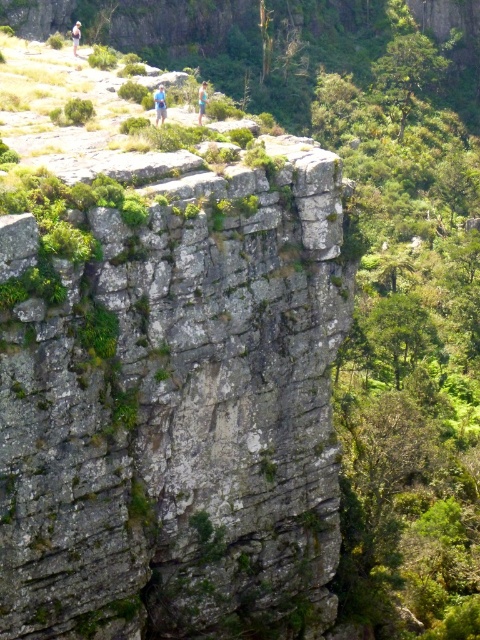
Which is behind, point (157, 97) or point (72, 32)?

The point (72, 32) is behind.

Who is positioned more to the left, blue fabric person at upper center or blue denim shorts at upper left?

Positioned to the left is blue denim shorts at upper left.

The width and height of the screenshot is (480, 640). What do you see at coordinates (159, 104) in the screenshot?
I see `blue fabric person at upper center` at bounding box center [159, 104].

Find the location of a particular element. The image size is (480, 640). blue fabric person at upper center is located at coordinates (159, 104).

Measure the distance from blue fabric person at upper center to blue fabric shirt at upper center.

The distance of blue fabric person at upper center from blue fabric shirt at upper center is 17.66 feet.

Can you confirm if blue fabric person at upper center is thinner than blue fabric shirt at upper center?

Yes.

Does point (166, 115) come behind point (199, 99)?

No, (166, 115) is in front of (199, 99).

Find the location of a particular element. blue fabric person at upper center is located at coordinates (159, 104).

Which is more to the left, blue fabric shirt at upper center or blue denim shorts at upper left?

From the viewer's perspective, blue denim shorts at upper left appears more on the left side.

Is blue fabric shirt at upper center to the right of blue denim shorts at upper left from the viewer's perspective?

Correct, you'll find blue fabric shirt at upper center to the right of blue denim shorts at upper left.

Between point (201, 100) and point (72, 36), which one is positioned in front?

Point (201, 100) is more forward.

The image size is (480, 640). Identify the location of blue fabric shirt at upper center. (202, 100).